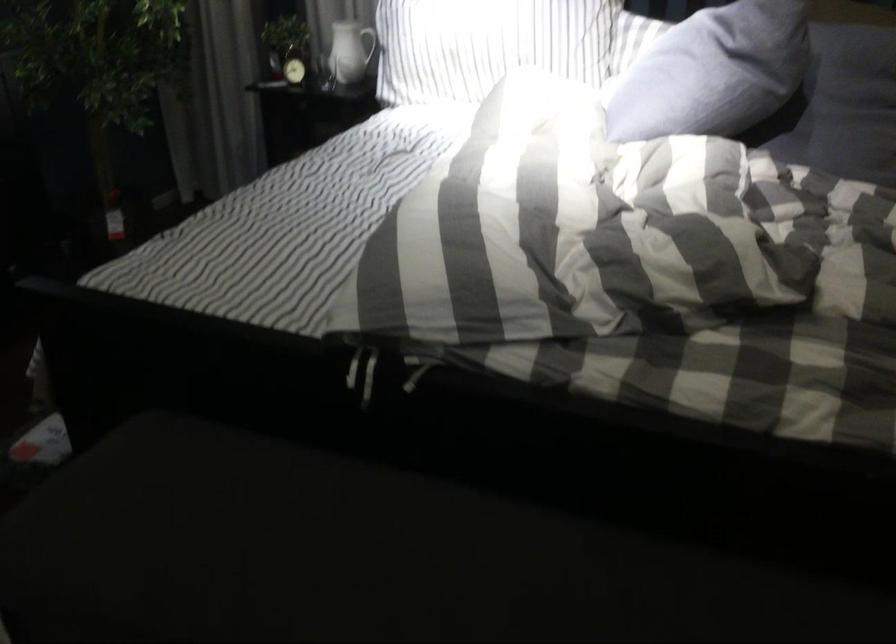
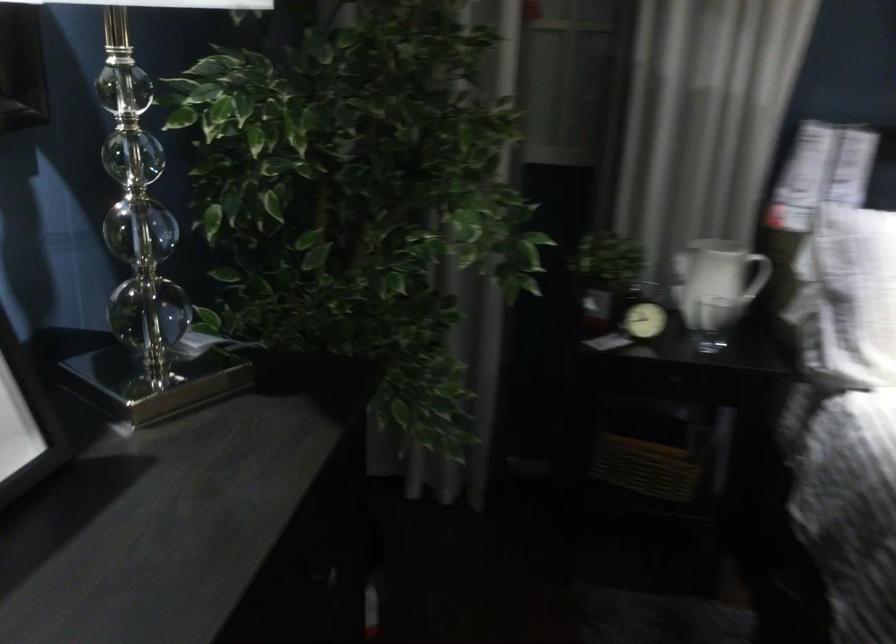
The point at (332, 73) is marked in the first image. Where is the corresponding point in the second image?

(713, 323)